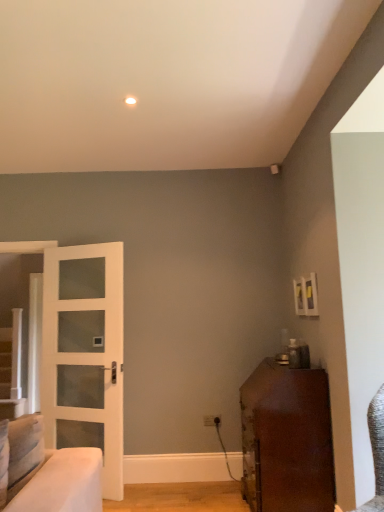
Find the location of a particular element. The image size is (384, 512). shiny brown cabinet at lower right is located at coordinates (287, 440).

Image resolution: width=384 pixels, height=512 pixels. What do you see at coordinates (287, 440) in the screenshot? I see `shiny brown cabinet at lower right` at bounding box center [287, 440].

The height and width of the screenshot is (512, 384). In order to click on white glass door at left in this screenshot , I will do `click(85, 353)`.

Describe the element at coordinates (85, 353) in the screenshot. The width and height of the screenshot is (384, 512). I see `white glass door at left` at that location.

Where is `shiny brown cabinet at lower right`? This screenshot has width=384, height=512. shiny brown cabinet at lower right is located at coordinates (287, 440).

Is white glass door at left to the left of shiny brown cabinet at lower right from the viewer's perspective?

Yes.

Which is in front, white glass door at left or shiny brown cabinet at lower right?

shiny brown cabinet at lower right is in front.

Between point (59, 293) and point (297, 445), which one is positioned in front?

The point (297, 445) is in front.

From the image's perspective, which one is positioned lower, white glass door at left or shiny brown cabinet at lower right?

shiny brown cabinet at lower right appears lower in the image.

From a real-world perspective, who is located lower, white glass door at left or shiny brown cabinet at lower right?

Answer: In real-world perspective, shiny brown cabinet at lower right is lower.

Which of these two, white glass door at left or shiny brown cabinet at lower right, is thinner?

Thinner between the two is white glass door at left.

Can you confirm if white glass door at left is shorter than shiny brown cabinet at lower right?

No.

Between white glass door at left and shiny brown cabinet at lower right, which one has larger size?

shiny brown cabinet at lower right.

Would you say white glass door at left is inside or outside shiny brown cabinet at lower right?

white glass door at left cannot be found inside shiny brown cabinet at lower right.

Looking at this image, is white glass door at left positioned far away from shiny brown cabinet at lower right?

white glass door at left is far away from shiny brown cabinet at lower right.

Is white glass door at left aimed at shiny brown cabinet at lower right?

No, white glass door at left is not oriented towards shiny brown cabinet at lower right.

What's the angular difference between white glass door at left and shiny brown cabinet at lower right's facing directions?

The facing directions of white glass door at left and shiny brown cabinet at lower right are 67.3 degrees apart.

Where is `furniture located underneath the white glass door at left (from a real-world perspective)`? furniture located underneath the white glass door at left (from a real-world perspective) is located at coordinates (287, 440).

Which object is positioned more to the left, shiny brown cabinet at lower right or white glass door at left?

Positioned to the left is white glass door at left.

Which object is more forward, shiny brown cabinet at lower right or white glass door at left?

shiny brown cabinet at lower right.

Is point (286, 483) more distant than point (109, 345)?

No, (286, 483) is in front of (109, 345).

From the image's perspective, is shiny brown cabinet at lower right above white glass door at left?

Incorrect, from the image's perspective, shiny brown cabinet at lower right is lower than white glass door at left.

From a real-world perspective, who is located higher, shiny brown cabinet at lower right or white glass door at left?

white glass door at left, from a real-world perspective.

Does shiny brown cabinet at lower right have a lesser width compared to white glass door at left?

Incorrect, the width of shiny brown cabinet at lower right is not less than that of white glass door at left.

Consider the image. Who is taller, shiny brown cabinet at lower right or white glass door at left?

white glass door at left is taller.

Can you confirm if shiny brown cabinet at lower right is smaller than white glass door at left?

Incorrect, shiny brown cabinet at lower right is not smaller in size than white glass door at left.

Would you say white glass door at left is part of shiny brown cabinet at lower right's contents?

That's incorrect, white glass door at left is not inside shiny brown cabinet at lower right.

Are shiny brown cabinet at lower right and white glass door at left far apart?

Yes, shiny brown cabinet at lower right and white glass door at left are located far from each other.

Does shiny brown cabinet at lower right turn towards white glass door at left?

Yes, shiny brown cabinet at lower right is facing white glass door at left.

I want to click on door that is above the shiny brown cabinet at lower right (from the image's perspective), so click(x=85, y=353).

Locate an element on the screen. The height and width of the screenshot is (512, 384). furniture below the white glass door at left (from a real-world perspective) is located at coordinates (287, 440).

At what (x,y) coordinates should I click in order to perform the action: click on door that appears above the shiny brown cabinet at lower right (from a real-world perspective). Please return your answer as a coordinate pair (x, y). Looking at the image, I should click on (85, 353).